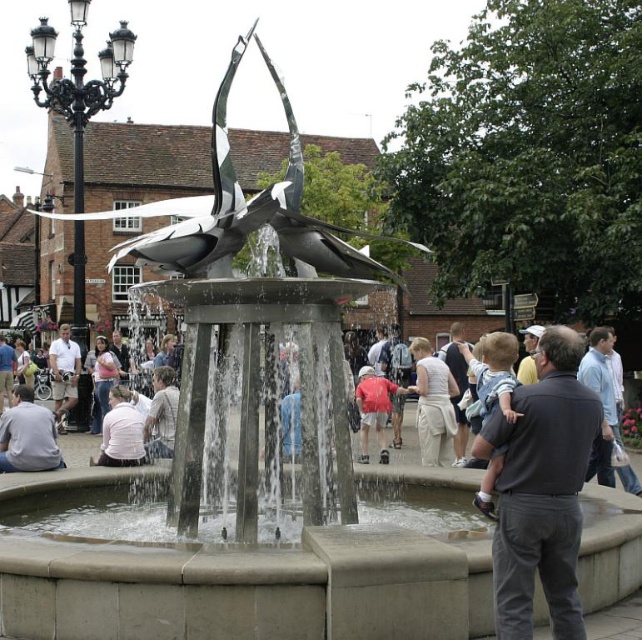
Question: Which of the following is the farthest from the observer?

Choices:
 (A) (361, 385)
 (B) (71, 384)

Answer: (B)

Question: Is gray fabric shirt at lower left to the right of light pink shirt at center from the viewer's perspective?

Choices:
 (A) yes
 (B) no

Answer: (A)

Question: Which point is closer to the camera taking this photo?

Choices:
 (A) (365, 417)
 (B) (139, 440)
 (C) (426, 374)

Answer: (B)

Question: Which object appears farthest from the camera in this image?

Choices:
 (A) white shirt at left
 (B) light pink shirt at center
 (C) matte red shirt at center

Answer: (A)

Question: Is light beige cotton dress at center positioned at the back of matte red shirt at center?

Choices:
 (A) yes
 (B) no

Answer: (A)

Question: Is light beige cotton dress at center bigger than matte red shirt at center?

Choices:
 (A) yes
 (B) no

Answer: (A)